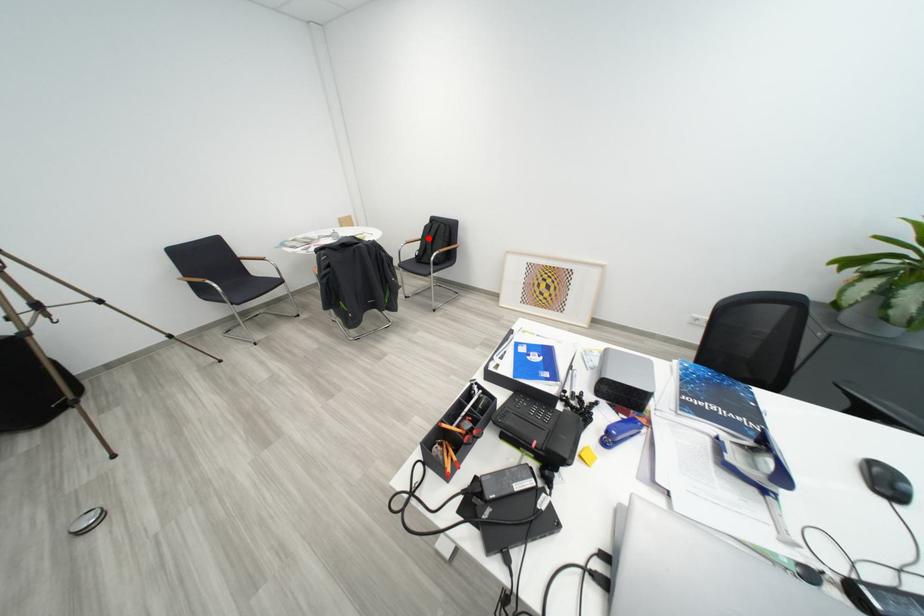
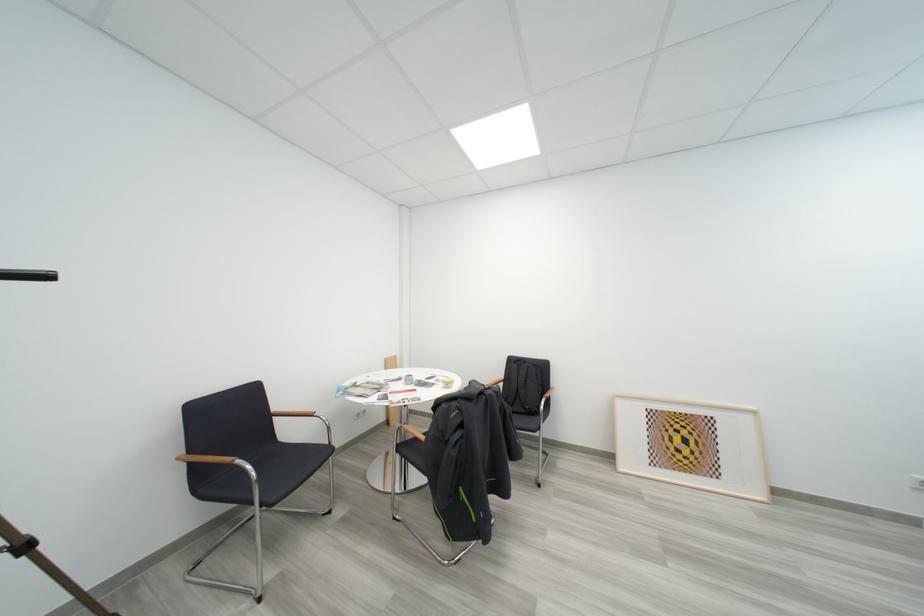
Locate, in the second image, the point that corresponds to the highlighted location in the first image.

(512, 381)